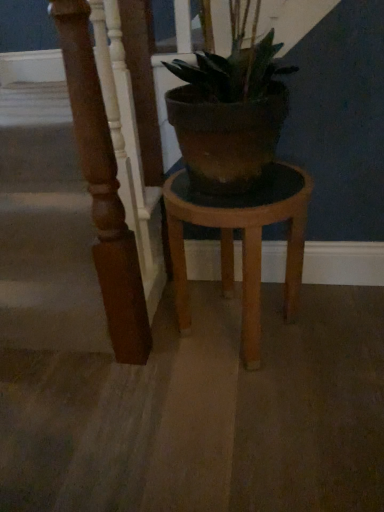
The image size is (384, 512). Identify the location of blank space to the left of wooden stool at center. (130, 375).